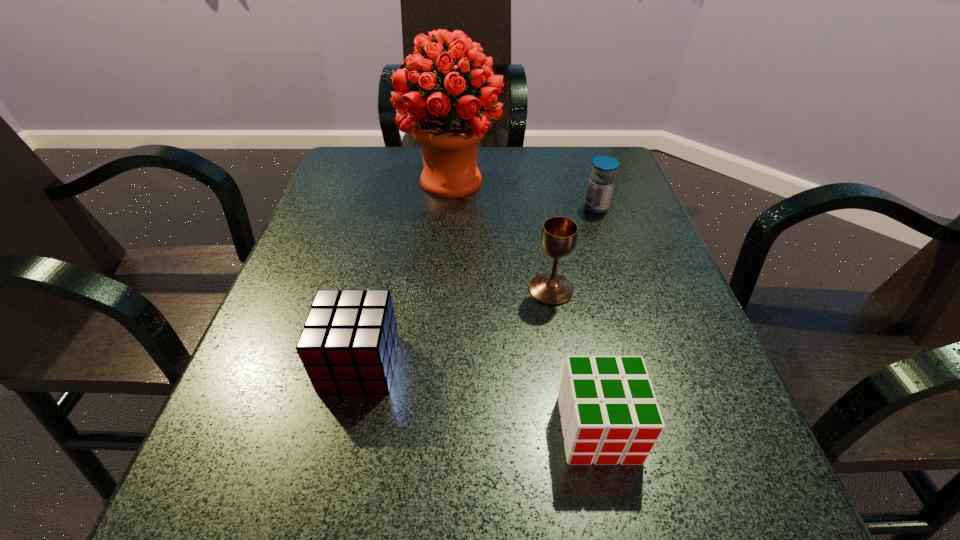
The height and width of the screenshot is (540, 960). I want to click on vacant space located 0.090m on the front of the medicine, so click(607, 239).

Find the location of a particular element. This screenshot has width=960, height=540. free region located 0.150m on the front of the second nearest object is located at coordinates (328, 496).

Identify the location of blank space located on the red face of the nearer cube. (619, 530).

Where is `object that is positioned at the far edge`? object that is positioned at the far edge is located at coordinates (448, 135).

You are a GUI agent. You are given a task and a screenshot of the screen. Output one action in this format:
    pyautogui.click(x=<x>, y=<y>)
    Task: Click on the object located at the left edge
    The image size is (960, 540).
    Given the screenshot: What is the action you would take?
    pyautogui.click(x=348, y=344)

Identify the location of medicine located in the right edge section of the desktop. Image resolution: width=960 pixels, height=540 pixels. (601, 183).

At what (x,y) coordinates should I click in order to perform the action: click on cube located at the right edge. Please return your answer as a coordinate pair (x, y). Looking at the image, I should click on click(609, 415).

Image resolution: width=960 pixels, height=540 pixels. In the image, there is a desktop. In order to click on vacant space at the far edge in this screenshot , I will do `click(418, 145)`.

You are a GUI agent. You are given a task and a screenshot of the screen. Output one action in this format:
    pyautogui.click(x=<x>, y=<y>)
    Task: Click on the free space at the near edge of the desktop
    
    Given the screenshot: What is the action you would take?
    pyautogui.click(x=474, y=509)

Where is `free space at the left edge of the desktop`? This screenshot has height=540, width=960. free space at the left edge of the desktop is located at coordinates 318,252.